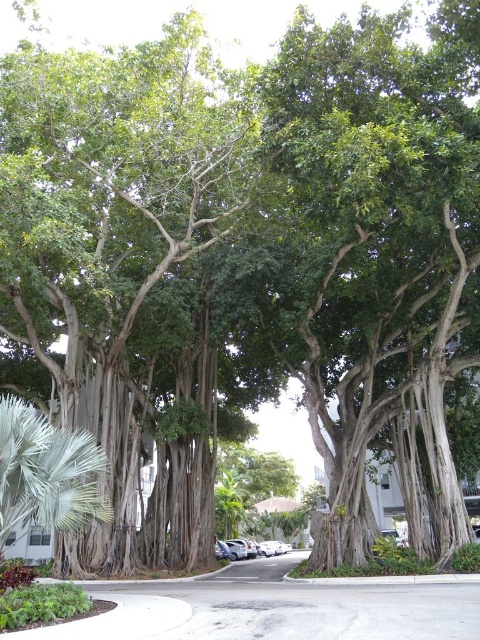
What do you see at coordinates (380, 257) in the screenshot? I see `green leafy banyan tree at center` at bounding box center [380, 257].

Locate an element on the screen. This screenshot has width=480, height=640. green leafy banyan tree at center is located at coordinates (380, 257).